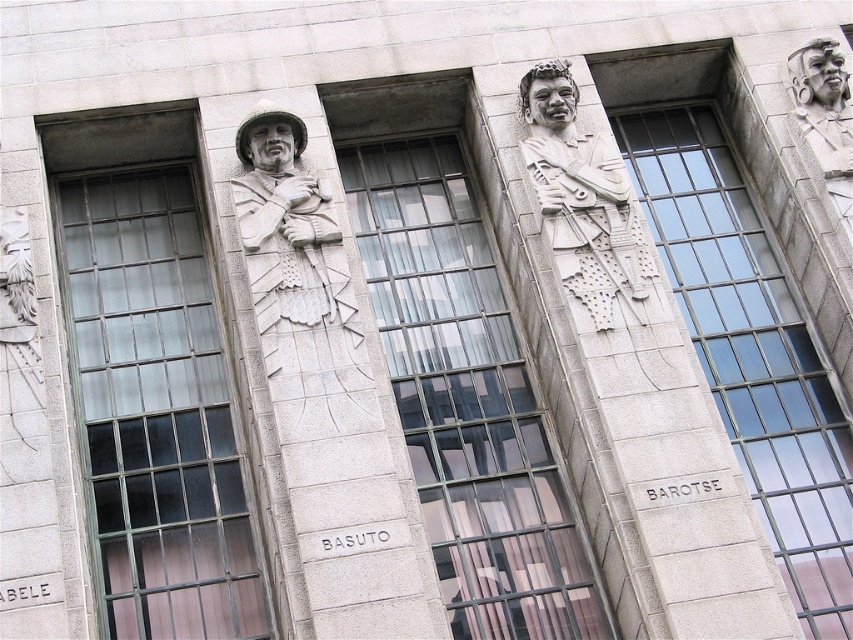
Is the position of clear glass window at center less distant than that of white stone soldier at center-left?

No, clear glass window at center is behind white stone soldier at center-left.

Does clear glass window at center appear on the right side of white stone soldier at center-left?

Yes, clear glass window at center is to the right of white stone soldier at center-left.

Does point (379, 234) lie behind point (279, 355)?

Yes, point (379, 234) is behind point (279, 355).

At what (x,y) coordinates should I click in order to perform the action: click on clear glass window at center. Please return your answer as a coordinate pair (x, y). This screenshot has width=853, height=640. Looking at the image, I should click on (466, 400).

Can you confirm if clear glass window at left is wider than white stone soldier at center-left?

Correct, the width of clear glass window at left exceeds that of white stone soldier at center-left.

Between clear glass window at left and white stone soldier at center-left, which one appears on the right side from the viewer's perspective?

From the viewer's perspective, white stone soldier at center-left appears more on the right side.

Does point (190, 477) lie in front of point (331, 227)?

Yes, point (190, 477) is closer to viewer.

Where is `clear glass window at left`? This screenshot has height=640, width=853. clear glass window at left is located at coordinates (154, 381).

Is white stone figure at center wider than polished stone head at upper right?

Yes, white stone figure at center is wider than polished stone head at upper right.

Looking at this image, does white stone figure at center lie in front of polished stone head at upper right?

Yes, it is in front of polished stone head at upper right.

Find the location of a particular element. Image resolution: width=853 pixels, height=640 pixels. white stone figure at center is located at coordinates (590, 216).